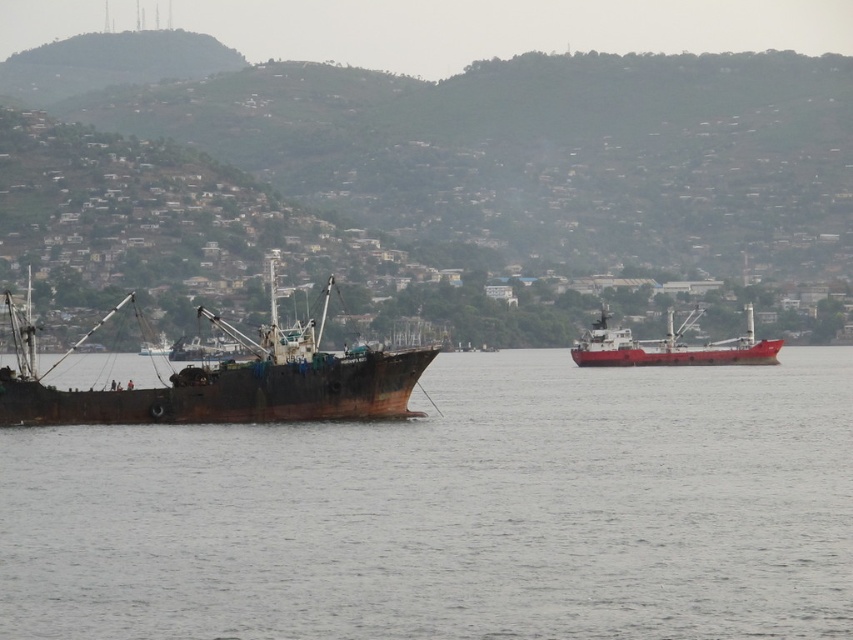
In the scene shown: Does gray matte water at center have a larger size compared to rusty metal ship at left?

No.

Describe the element at coordinates (454, 512) in the screenshot. I see `gray matte water at center` at that location.

Find the location of `gray matte water at center`. gray matte water at center is located at coordinates (454, 512).

Is gray matte water at center positioned in front of red matte cargo ship at center?

Yes, gray matte water at center is closer to the viewer.

In the scene shown: Is gray matte water at center above red matte cargo ship at center?

No, gray matte water at center is not above red matte cargo ship at center.

Find the location of `gray matte water at center`. gray matte water at center is located at coordinates (454, 512).

Between point (373, 396) and point (701, 362), which one is positioned behind?

Point (701, 362)

Which is more to the right, rusty metal ship at left or red matte cargo ship at center?

red matte cargo ship at center

Is point (10, 301) positioned in front of point (625, 328)?

Yes.

Identify the location of rusty metal ship at left. (225, 381).